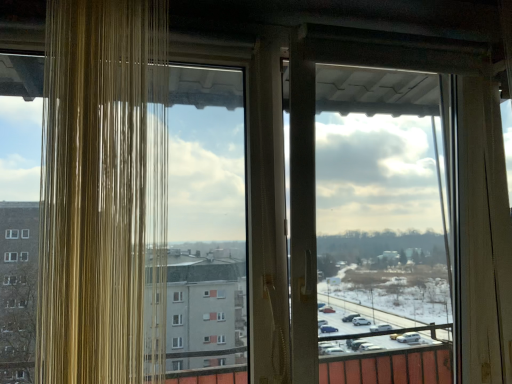
In order to click on translucent glass window at left in this screenshot , I will do `click(103, 193)`.

Describe the element at coordinates (103, 193) in the screenshot. This screenshot has width=512, height=384. I see `translucent glass window at left` at that location.

Measure the distance between transparent plastic screen door at center and camera.

transparent plastic screen door at center is 5.05 feet away from camera.

Locate an element on the screen. transparent plastic screen door at center is located at coordinates (362, 226).

What do you see at coordinates (362, 226) in the screenshot?
I see `transparent plastic screen door at center` at bounding box center [362, 226].

Find the location of a particular element. The height and width of the screenshot is (384, 512). translucent glass window at left is located at coordinates (103, 193).

Which is more to the right, transparent plastic screen door at center or translucent glass window at left?

Positioned to the right is transparent plastic screen door at center.

Does transparent plastic screen door at center come in front of translucent glass window at left?

No.

Is point (296, 326) closer or farther from the camera than point (81, 273)?

Point (296, 326) is positioned farther from the camera compared to point (81, 273).

From the image's perspective, is transparent plastic screen door at center on top of translucent glass window at left?

No.

From a real-world perspective, is transparent plastic screen door at center physically located above or below translucent glass window at left?

Clearly, from a real-world perspective, transparent plastic screen door at center is below translucent glass window at left.

Considering the sizes of objects transparent plastic screen door at center and translucent glass window at left in the image provided, who is wider, transparent plastic screen door at center or translucent glass window at left?

Wider between the two is transparent plastic screen door at center.

Which of these two, transparent plastic screen door at center or translucent glass window at left, stands taller?

transparent plastic screen door at center.

Is transparent plastic screen door at center smaller than translucent glass window at left?

No.

Is transparent plastic screen door at center not inside translucent glass window at left?

Yes, transparent plastic screen door at center is located beyond the bounds of translucent glass window at left.

Is transparent plastic screen door at center placed right next to translucent glass window at left?

No.

Is transparent plastic screen door at center positioned with its back to translucent glass window at left?

No, transparent plastic screen door at center's orientation is not away from translucent glass window at left.

Can you tell me how much transparent plastic screen door at center and translucent glass window at left differ in facing direction?

The angular difference between transparent plastic screen door at center and translucent glass window at left is 0.562 degrees.

Measure the distance from transparent plastic screen door at center to translucent glass window at left.

The distance of transparent plastic screen door at center from translucent glass window at left is 3.52 feet.

This screenshot has height=384, width=512. I want to click on window in front of the transparent plastic screen door at center, so click(103, 193).

Between translucent glass window at left and transparent plastic screen door at center, which one appears on the left side from the viewer's perspective?

Positioned to the left is translucent glass window at left.

In the image, is translucent glass window at left positioned in front of or behind transparent plastic screen door at center?

translucent glass window at left is in front of transparent plastic screen door at center.

Does point (122, 293) appear closer or farther from the camera than point (373, 141)?

Point (122, 293) appears to be closer to the viewer than point (373, 141).

From the image's perspective, is translucent glass window at left located above or below transparent plastic screen door at center?

Clearly, from the image's perspective, translucent glass window at left is above transparent plastic screen door at center.

From a real-world perspective, who is located lower, translucent glass window at left or transparent plastic screen door at center?

In real-world perspective, transparent plastic screen door at center is lower.

Considering the sizes of objects translucent glass window at left and transparent plastic screen door at center in the image provided, who is thinner, translucent glass window at left or transparent plastic screen door at center?

translucent glass window at left is thinner.

Who is shorter, translucent glass window at left or transparent plastic screen door at center?

With less height is translucent glass window at left.

Can you confirm if translucent glass window at left is smaller than transparent plastic screen door at center?

Correct, translucent glass window at left occupies less space than transparent plastic screen door at center.

Choose the correct answer: Is translucent glass window at left inside transparent plastic screen door at center or outside it?

The correct answer is: outside.

Are translucent glass window at left and transparent plastic screen door at center beside each other?

No, translucent glass window at left is not next to transparent plastic screen door at center.

Is translucent glass window at left turned away from transparent plastic screen door at center?

No, transparent plastic screen door at center is not at the back of translucent glass window at left.

How different are the orientations of translucent glass window at left and transparent plastic screen door at center in degrees?

The facing directions of translucent glass window at left and transparent plastic screen door at center are 0.562 degrees apart.

Locate an element on the screen. window located above the transparent plastic screen door at center (from a real-world perspective) is located at coordinates (103, 193).

You are a GUI agent. You are given a task and a screenshot of the screen. Output one action in this format:
    pyautogui.click(x=<x>, y=<y>)
    Task: Click on the screen door directly beneath the translucent glass window at left (from a real-world perspective)
    This screenshot has height=384, width=512.
    Given the screenshot: What is the action you would take?
    pyautogui.click(x=362, y=226)

This screenshot has height=384, width=512. Find the location of `window that appears above the transparent plastic screen door at center (from the image's perspective)`. window that appears above the transparent plastic screen door at center (from the image's perspective) is located at coordinates (103, 193).